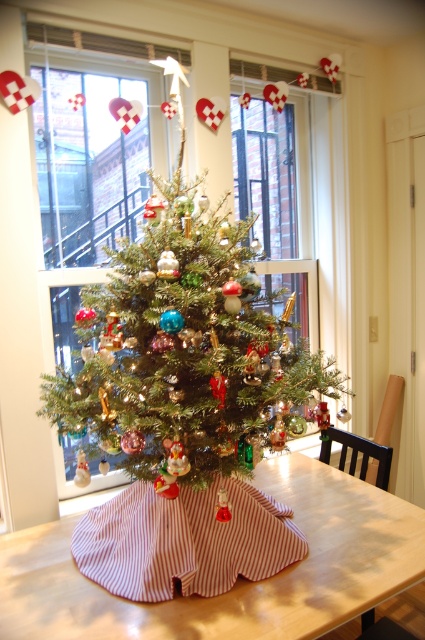
You are standing in front of the Christmas tree and want to place a small gift at point (223, 328). If your arm reaches 1.1 meters, can you reach that point?

The distance of point (223, 328) from viewer is 1.23 meters, so no, your arm cannot reach that point since it is further away than your arm length.

You are placing a gift under the green matte christmas tree at center and the wooden table at center. Which surface will the gift land on first?

The gift will land on the wooden table at center first because the green matte christmas tree at center is positioned over it.

You are standing in front of the Christmas tree and want to place a small gift. You have two points marked on the image where you can place it. The points are point 1 at [87,376] and point 2 at [221,618]. Which point is closer to you so that you can easily reach it?

Point 1 at [87,376] is closer to you than point 2 at [221,618] because it is further to the camera, meaning it is physically nearer to your position.